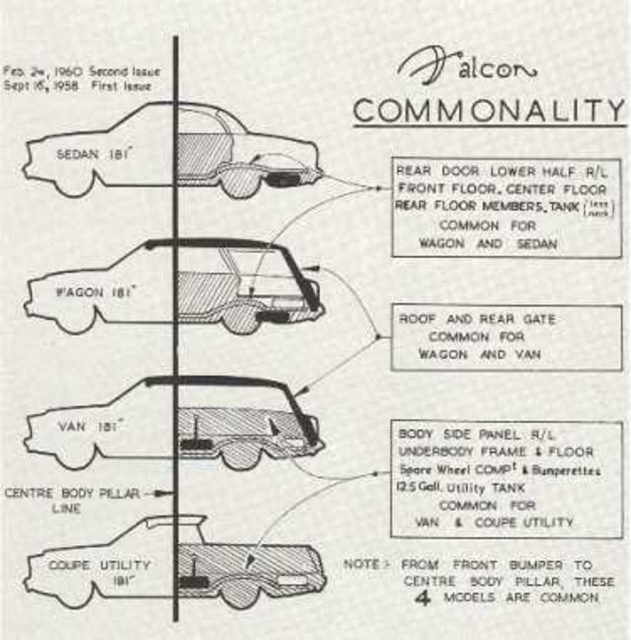
Which is more to the left, matte black wagon at center or matte black van at center?

From the viewer's perspective, matte black wagon at center appears more on the left side.

Who is more forward, (168, 256) or (78, 428)?

Point (78, 428) is more forward.

Is point (49, 284) farther from camera compared to point (184, 454)?

Yes.

Where is `matte black wagon at center`? matte black wagon at center is located at coordinates (242, 284).

Does point (121, 172) come farther from viewer compared to point (295, 397)?

No, (121, 172) is in front of (295, 397).

Is matte black sedan at upper left below matte black van at center?

No.

Is point (247, 157) in front of point (262, 451)?

No, (247, 157) is further to viewer.

Find the location of a particular element. Image resolution: width=631 pixels, height=640 pixels. matte black sedan at upper left is located at coordinates (107, 154).

Between point (304, 285) and point (167, 573), which one is positioned in front?

Positioned in front is point (167, 573).

Is matte black wagon at center to the right of matte black coupe utility at lower center from the viewer's perspective?

In fact, matte black wagon at center is to the left of matte black coupe utility at lower center.

Locate an element on the screen. matte black wagon at center is located at coordinates tap(242, 284).

Where is `matte black wagon at center`? Image resolution: width=631 pixels, height=640 pixels. matte black wagon at center is located at coordinates (242, 284).